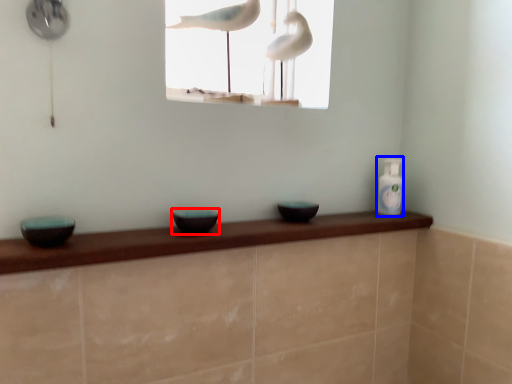
Question: Which object appears closest to the camera in this image, basin (highlighted by a red box) or bottle (highlighted by a blue box)?

Choices:
 (A) basin
 (B) bottle

Answer: (A)